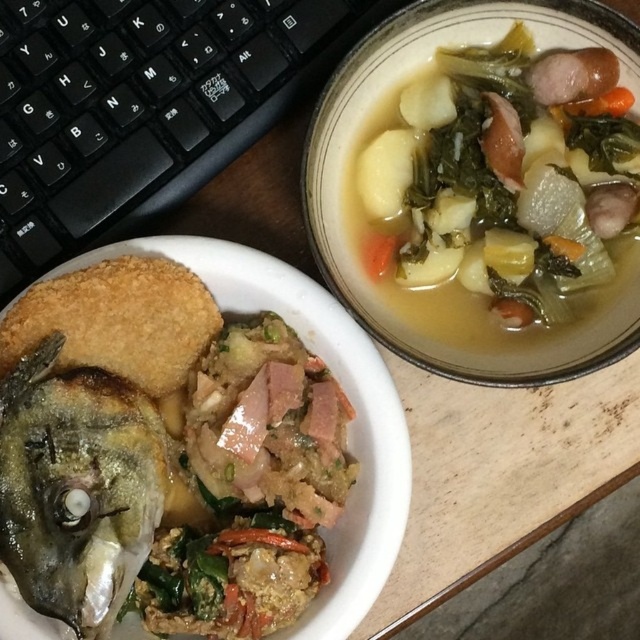
Question: Is green leafy vegetable at upper right positioned before white matte bowl at center?

Choices:
 (A) no
 (B) yes

Answer: (A)

Question: Which point is farther to the camera?

Choices:
 (A) shiny silver fish head at lower left
 (B) golden crispy bread at upper left
 (C) white matte bowl at center

Answer: (B)

Question: Considering the real-world distances, which object is closest to the shiny silver fish head at lower left?

Choices:
 (A) golden crispy bread at upper left
 (B) green leafy vegetable at upper right

Answer: (A)

Question: Which object is the closest to the green leafy vegetable at upper right?

Choices:
 (A) white matte bowl at center
 (B) golden crispy bread at upper left
 (C) shiny silver fish head at lower left

Answer: (A)

Question: Can you confirm if green leafy vegetable at upper right is thinner than white matte bowl at center?

Choices:
 (A) yes
 (B) no

Answer: (A)

Question: Is shiny silver fish head at lower left bigger than golden crispy bread at upper left?

Choices:
 (A) no
 (B) yes

Answer: (B)